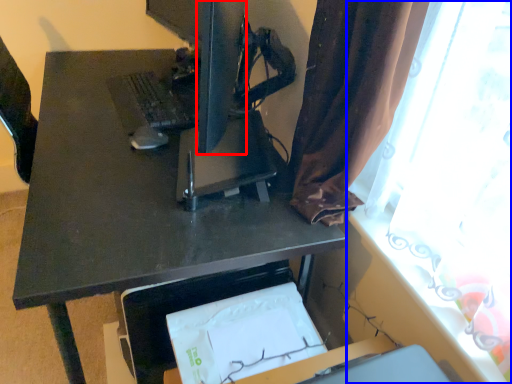
Question: Which object appears farthest to the camera in this image, computer monitor (highlighted by a red box) or curtain (highlighted by a blue box)?

Choices:
 (A) computer monitor
 (B) curtain

Answer: (A)